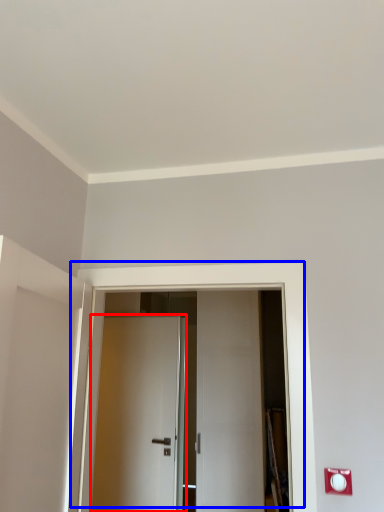
Question: Which point is closer to the camera, door (highlighted by a red box) or door (highlighted by a blue box)?

Choices:
 (A) door
 (B) door

Answer: (B)